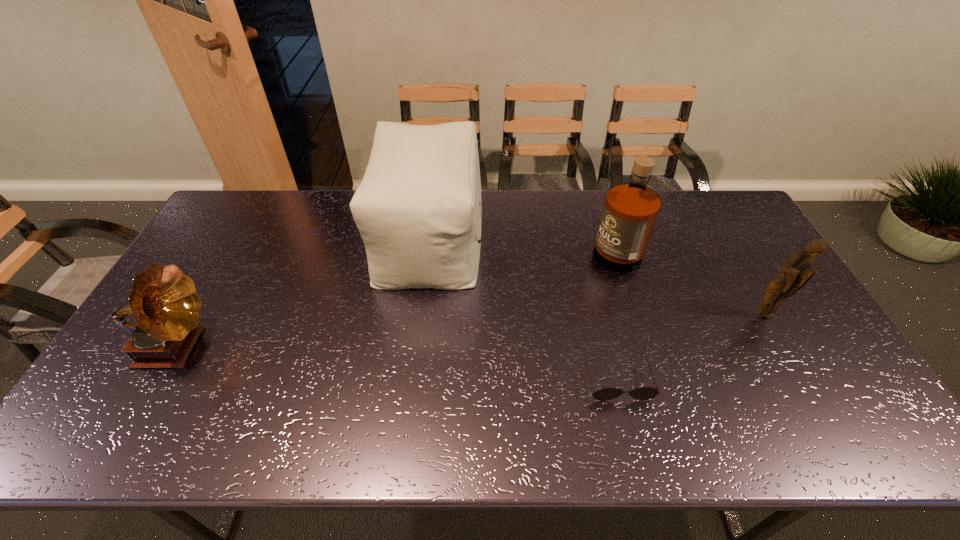
You are a GUI agent. You are given a task and a screenshot of the screen. Output one action in this format:
    pyautogui.click(x=<x>, y=<y>)
    Task: Click on the free space located 0.210m on the horn of the leftmost object
    Image resolution: width=960 pixels, height=540 pixels.
    Given the screenshot: What is the action you would take?
    pyautogui.click(x=291, y=348)

The height and width of the screenshot is (540, 960). What are the coordinates of `blank space located 0.090m on the front-facing side of the shortest object` in the screenshot? It's located at (632, 437).

This screenshot has height=540, width=960. Find the location of `liquor that is at the far edge`. liquor that is at the far edge is located at coordinates (630, 211).

Identify the location of cushion present at the far edge. (418, 209).

Identify the location of object present at the left edge. The height and width of the screenshot is (540, 960). (164, 301).

Locate an element on the screen. The height and width of the screenshot is (540, 960). object at the right edge is located at coordinates (795, 272).

I want to click on vacant space at the far edge of the desktop, so click(495, 197).

I want to click on vacant area at the near edge, so click(353, 418).

The height and width of the screenshot is (540, 960). Find the location of `vacant region at the left edge of the desktop`. vacant region at the left edge of the desktop is located at coordinates (198, 284).

This screenshot has height=540, width=960. Identify the location of blank area at the right edge. (748, 271).